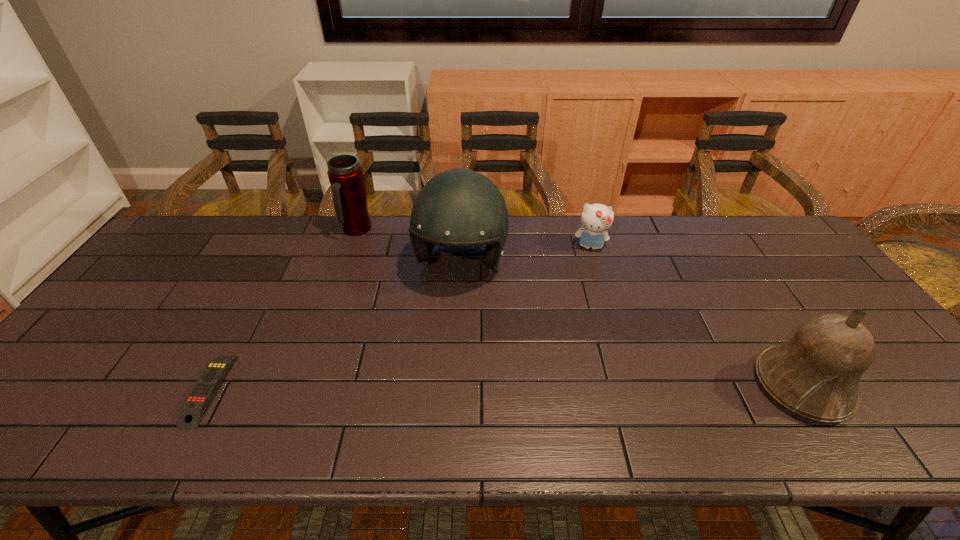
Where is `vacant area located at the face opening of the third object from right to left`? vacant area located at the face opening of the third object from right to left is located at coordinates (431, 360).

I want to click on free space located 0.340m at the face opening of the third object from right to left, so tap(418, 403).

Where is `vacant point located 0.320m at the face opening of the third object from right to left`? vacant point located 0.320m at the face opening of the third object from right to left is located at coordinates (420, 395).

Locate an element on the screen. The image size is (960, 540). free space located 0.390m on the side with the handle of the thermos bottle is located at coordinates (397, 322).

Where is `vacant space located 0.270m on the side with the handle of the thermos bottle`? The image size is (960, 540). vacant space located 0.270m on the side with the handle of the thermos bottle is located at coordinates (384, 293).

Where is `free spot located 0.390m on the side with the handle of the thermos bottle`? The width and height of the screenshot is (960, 540). free spot located 0.390m on the side with the handle of the thermos bottle is located at coordinates (397, 322).

This screenshot has height=540, width=960. In order to click on vacant space located on the front-facing side of the fourth object from left to right in this screenshot , I will do `click(582, 342)`.

Where is `vacant space situated on the front-facing side of the fourth object from left to right`? The image size is (960, 540). vacant space situated on the front-facing side of the fourth object from left to right is located at coordinates (585, 307).

Image resolution: width=960 pixels, height=540 pixels. In order to click on vacant space located 0.350m on the front-facing side of the fourth object from left to right in this screenshot , I will do `click(582, 340)`.

I want to click on football helmet that is at the far edge, so pos(458,207).